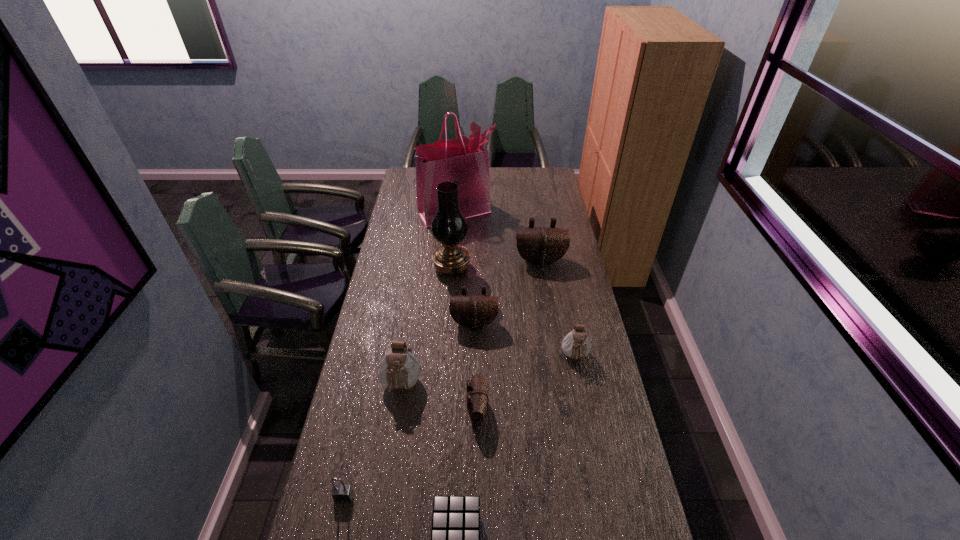
The height and width of the screenshot is (540, 960). Find the location of `vacant region located 0.360m with the flap open on the nearest brown pouch`. vacant region located 0.360m with the flap open on the nearest brown pouch is located at coordinates (601, 410).

Where is `shopping bag that is positioned at the left edge`? shopping bag that is positioned at the left edge is located at coordinates (464, 161).

The height and width of the screenshot is (540, 960). Identify the location of pouch positioned at the left edge. (399, 369).

Identify the location of padlock that is at the left edge. (342, 493).

Image resolution: width=960 pixels, height=540 pixels. In the image, there is a desktop. Identify the location of vacant space at the far edge. (511, 186).

This screenshot has width=960, height=540. In the image, there is a desktop. In order to click on vacant region at the left edge in this screenshot , I will do `click(350, 424)`.

In the image, there is a desktop. Where is `blank space at the right edge`? The height and width of the screenshot is (540, 960). blank space at the right edge is located at coordinates (553, 202).

Where is `vacant area between the nearest brown pouch and the left white pouch`? The image size is (960, 540). vacant area between the nearest brown pouch and the left white pouch is located at coordinates (440, 398).

You are a GUI agent. You are given a task and a screenshot of the screen. Output one action in this format:
    pyautogui.click(x=<x>, y=<y>)
    Task: Click on the blank region between the bigger white pouch and the smaller white pouch
    This screenshot has height=540, width=960.
    Given the screenshot: What is the action you would take?
    [x=489, y=372]

What are the coordinates of `vacant space that's between the right white pouch and the biggest brown pouch` in the screenshot? It's located at (558, 309).